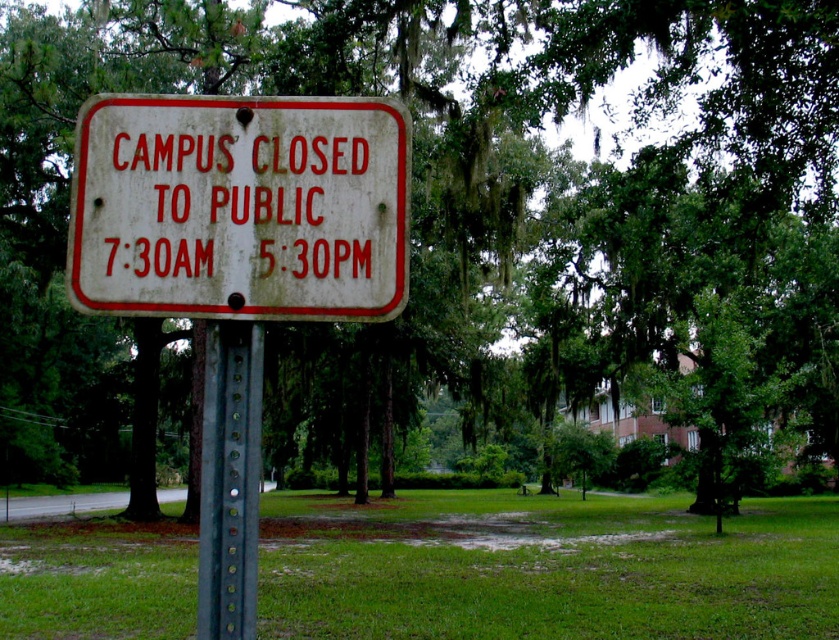
Question: Among these points, which one is farthest from the camera?

Choices:
 (A) (220, 224)
 (B) (212, 612)

Answer: (A)

Question: Can you confirm if white weathered sign at center is smaller than green metallic pole at center?

Choices:
 (A) yes
 (B) no

Answer: (B)

Question: Which object is closer to the camera taking this photo?

Choices:
 (A) green metallic pole at center
 (B) white weathered sign at center

Answer: (A)

Question: Can you confirm if white weathered sign at center is wider than green metallic pole at center?

Choices:
 (A) yes
 (B) no

Answer: (A)

Question: Is white weathered sign at center closer to camera compared to green metallic pole at center?

Choices:
 (A) no
 (B) yes

Answer: (A)